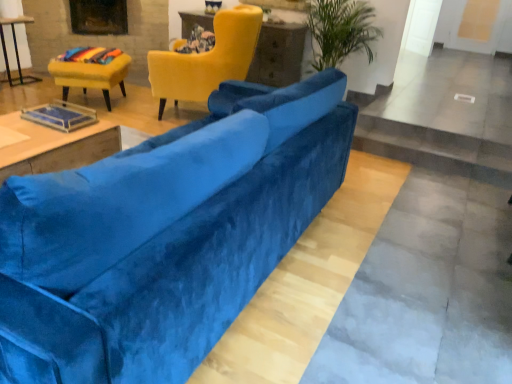
Question: From the image's perspective, is dark brown wood fireplace at upper left located beneath matte yellow table at upper center, the 3th table when ordered from bottom to top?

Choices:
 (A) yes
 (B) no

Answer: (B)

Question: From a real-world perspective, does dark brown wood fireplace at upper left sit lower than matte yellow table at upper center, the first table in the top-to-bottom sequence?

Choices:
 (A) yes
 (B) no

Answer: (B)

Question: Considering the relative positions of dark brown wood fireplace at upper left and matte yellow table at upper center, which is the first table in right-to-left order, in the image provided, is dark brown wood fireplace at upper left to the right of matte yellow table at upper center, which is the first table in right-to-left order, from the viewer's perspective?

Choices:
 (A) no
 (B) yes

Answer: (A)

Question: Is dark brown wood fireplace at upper left bigger than matte yellow table at upper center, which ranks as the 1th table in back-to-front order?

Choices:
 (A) no
 (B) yes

Answer: (A)

Question: Considering the relative sizes of dark brown wood fireplace at upper left and matte yellow table at upper center, the first table in the top-to-bottom sequence, in the image provided, is dark brown wood fireplace at upper left taller than matte yellow table at upper center, the first table in the top-to-bottom sequence,?

Choices:
 (A) no
 (B) yes

Answer: (A)

Question: Does dark brown wood fireplace at upper left have a lesser height compared to matte yellow table at upper center, placed as the third table when sorted from left to right?

Choices:
 (A) yes
 (B) no

Answer: (A)

Question: From a real-world perspective, is velvet yellow chair at upper left, which is counted as the 2th chair, starting from the right, on dark brown wood fireplace at upper left?

Choices:
 (A) no
 (B) yes

Answer: (A)

Question: Is velvet yellow chair at upper left, which is counted as the 2th chair, starting from the right, at the right side of dark brown wood fireplace at upper left?

Choices:
 (A) no
 (B) yes

Answer: (B)

Question: Is velvet yellow chair at upper left, which is the first chair in left-to-right order, closer to the viewer compared to dark brown wood fireplace at upper left?

Choices:
 (A) no
 (B) yes

Answer: (B)

Question: From a real-world perspective, is velvet yellow chair at upper left, which is the first chair in left-to-right order, positioned under dark brown wood fireplace at upper left based on gravity?

Choices:
 (A) no
 (B) yes

Answer: (B)

Question: Considering the relative sizes of velvet yellow chair at upper left, which is counted as the 2th chair, starting from the right, and dark brown wood fireplace at upper left in the image provided, is velvet yellow chair at upper left, which is counted as the 2th chair, starting from the right, taller than dark brown wood fireplace at upper left?

Choices:
 (A) yes
 (B) no

Answer: (B)

Question: Does velvet yellow chair at upper left, which is counted as the 2th chair, starting from the right, come behind dark brown wood fireplace at upper left?

Choices:
 (A) no
 (B) yes

Answer: (A)

Question: Can you confirm if velvet blue couch at center is positioned to the right of velvet yellow armchair at upper center, arranged as the first chair when viewed from the right?

Choices:
 (A) yes
 (B) no

Answer: (A)